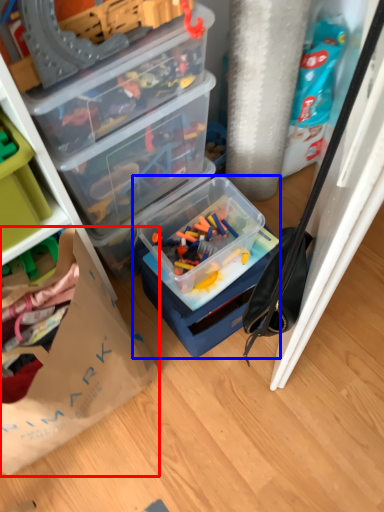
Question: Which object appears closest to the camera in this image, paper bag (highlighted by a red box) or box (highlighted by a blue box)?

Choices:
 (A) paper bag
 (B) box

Answer: (A)